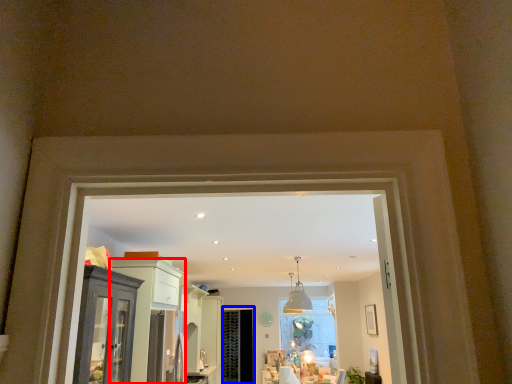
Question: Which point is closer to the camera, cabinetry (highlighted by a red box) or screen door (highlighted by a blue box)?

Choices:
 (A) cabinetry
 (B) screen door

Answer: (A)